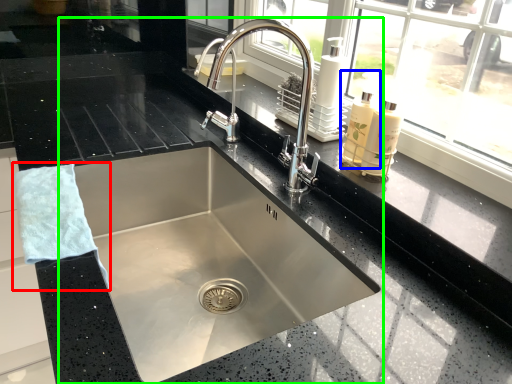
Question: Based on their relative distances, which object is nearer to hand towel (highlighted by a red box)? Choose from soap dispenser (highlighted by a blue box) and sink (highlighted by a green box).

Choices:
 (A) soap dispenser
 (B) sink

Answer: (B)